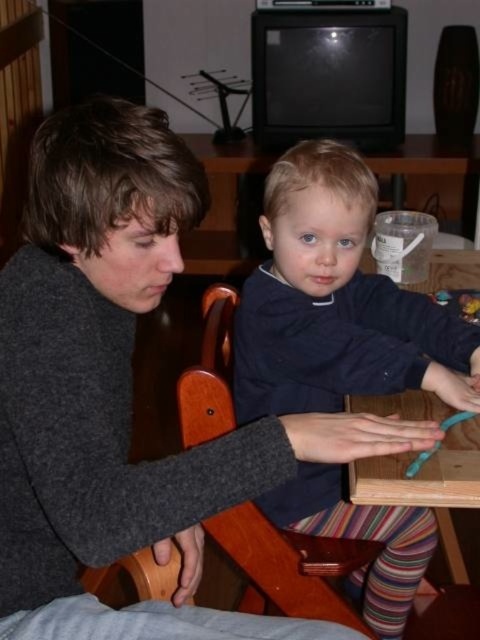
Question: Is dark blue sweater at center bigger than wooden chair at center?

Choices:
 (A) no
 (B) yes

Answer: (B)

Question: Is dark blue sweater at center above wooden chair at center?

Choices:
 (A) yes
 (B) no

Answer: (A)

Question: Is dark blue sweater at center closer to the viewer compared to wooden chair at center?

Choices:
 (A) no
 (B) yes

Answer: (A)

Question: Which object appears closest to the camera in this image?

Choices:
 (A) wooden chair at center
 (B) dark blue sweater at center

Answer: (A)